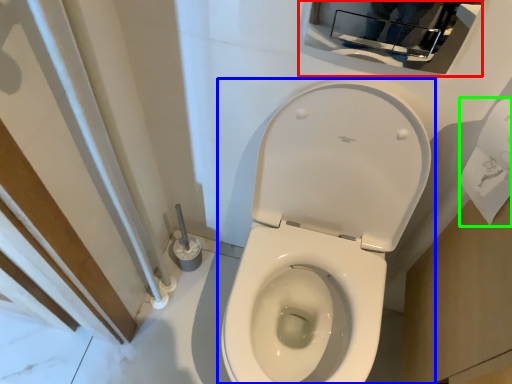
Question: Which object is the closest to the medicine cabinet (highlighted by a red box)? Choose among these: toilet (highlighted by a blue box) or toilet paper (highlighted by a green box).

Choices:
 (A) toilet
 (B) toilet paper

Answer: (B)